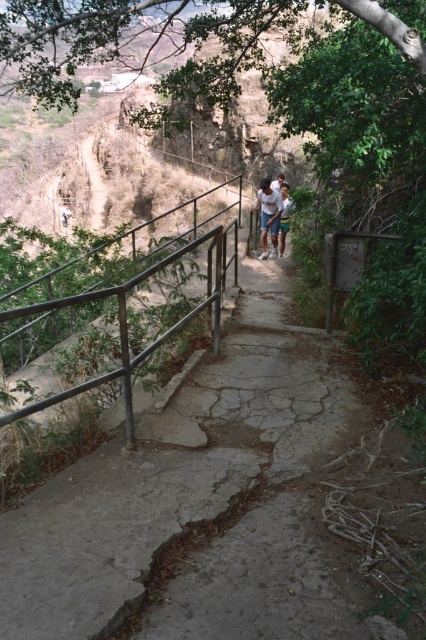
You are a hiker carrying a backpack and you see the cracked concrete path at center and the light blue denim shorts at center. Which object is wider?

The cracked concrete path at center is wider than the light blue denim shorts at center according to the description.

Looking at this image, you are standing at the bottom of the staircase and looking up. There are two points marked on the path. The first point is at coordinate point [288,634] and the second is at point [262,200]. Which point is closer to you as you look up the staircase?

Point [288,634] is closer to you because it is in front of point [262,200] along the staircase path.